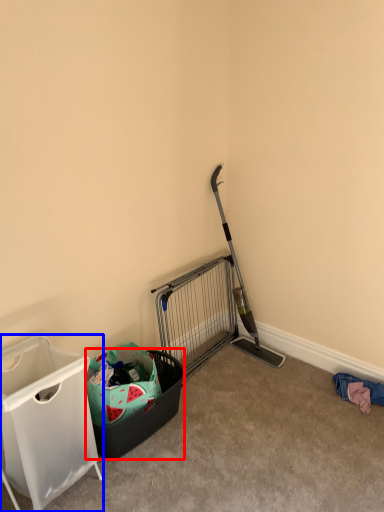
Question: Which of the following is the farthest to the observer, shopping basket (highlighted by a red box) or waste container (highlighted by a blue box)?

Choices:
 (A) shopping basket
 (B) waste container

Answer: (A)